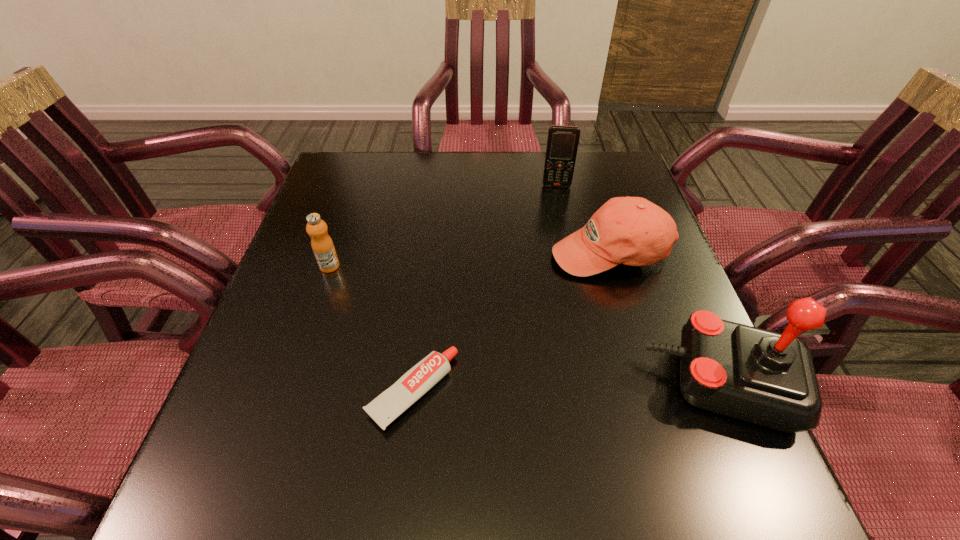
Where is `the second object from left to right`? the second object from left to right is located at coordinates (385, 408).

Image resolution: width=960 pixels, height=540 pixels. Identify the location of toothpaste. (385, 408).

Where is `joystick`? joystick is located at coordinates (759, 376).

The height and width of the screenshot is (540, 960). What are the coordinates of `the leftmost object` in the screenshot? It's located at (322, 245).

Where is `baseball cap`? The image size is (960, 540). baseball cap is located at coordinates (633, 231).

Locate an element on the screen. cellular telephone is located at coordinates [562, 143].

Image resolution: width=960 pixels, height=540 pixels. Identify the location of the farthest object. (562, 143).

Locate an element on the screen. This screenshot has width=960, height=540. vacant point located on the back of the second object from left to right is located at coordinates (432, 227).

The height and width of the screenshot is (540, 960). What are the coordinates of `free point located on the back of the joystick` in the screenshot? It's located at (659, 232).

Where is `vacant area situated on the front label of the orange juice`? vacant area situated on the front label of the orange juice is located at coordinates (366, 286).